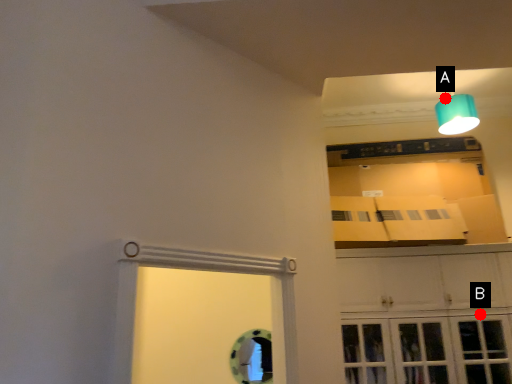
Question: Two points are circled on the image, labeled by A and B beside each circle. Which point is closer to the camera?

Choices:
 (A) A is closer
 (B) B is closer

Answer: (B)